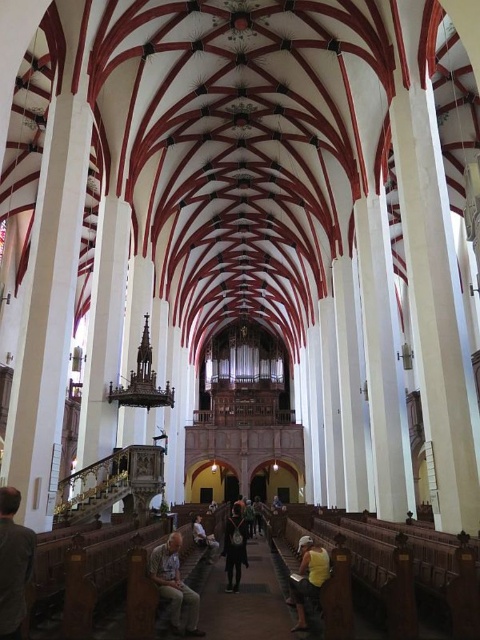
Question: Which of the following is the closest to the observer?

Choices:
 (A) yellow matte shirt at center
 (B) gray fabric jacket at lower left
 (C) dark blue fabric at center
 (D) light brown leather jacket at lower center

Answer: (B)

Question: Where is light brown leather jacket at lower center located in relation to dark blue fabric at center in the image?

Choices:
 (A) above
 (B) below

Answer: (A)

Question: Which point appears closest to the camera in this image?

Choices:
 (A) (29, 538)
 (B) (168, 545)
 (C) (310, 566)
 (D) (240, 566)

Answer: (A)

Question: Is gray fabric jacket at lower left smaller than yellow matte shirt at center?

Choices:
 (A) no
 (B) yes

Answer: (B)

Question: Which point is closer to the camera?

Choices:
 (A) (225, 528)
 (B) (299, 611)

Answer: (B)

Question: Is light brown leather jacket at lower center to the left of dark blue fabric at center from the viewer's perspective?

Choices:
 (A) no
 (B) yes

Answer: (B)